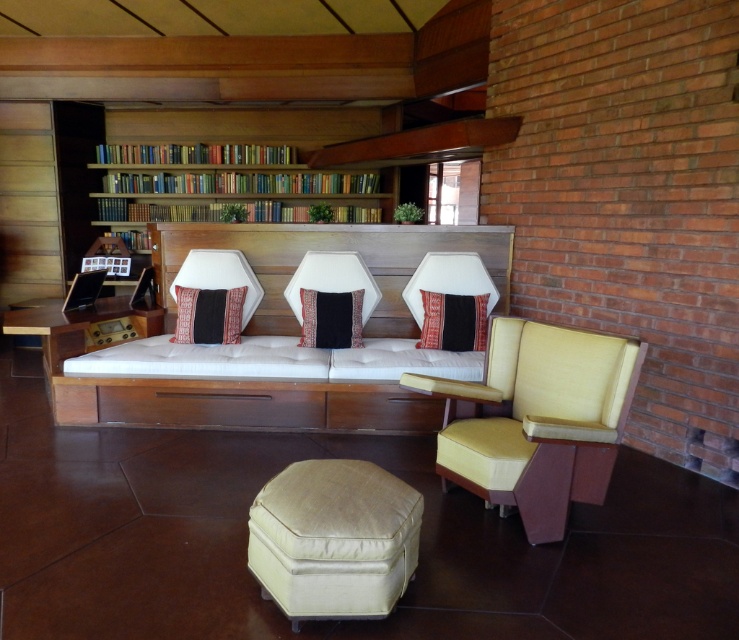
You are standing in the room and want to place a small potted plant between the matte yellow fabric armchair at center right and the beige fabric ottoman at center. Based on their positions, where should you place the plant?

The matte yellow fabric armchair at center right is located above the beige fabric ottoman at center, so you should place the plant between them at the lower position near the beige fabric ottoman at center.